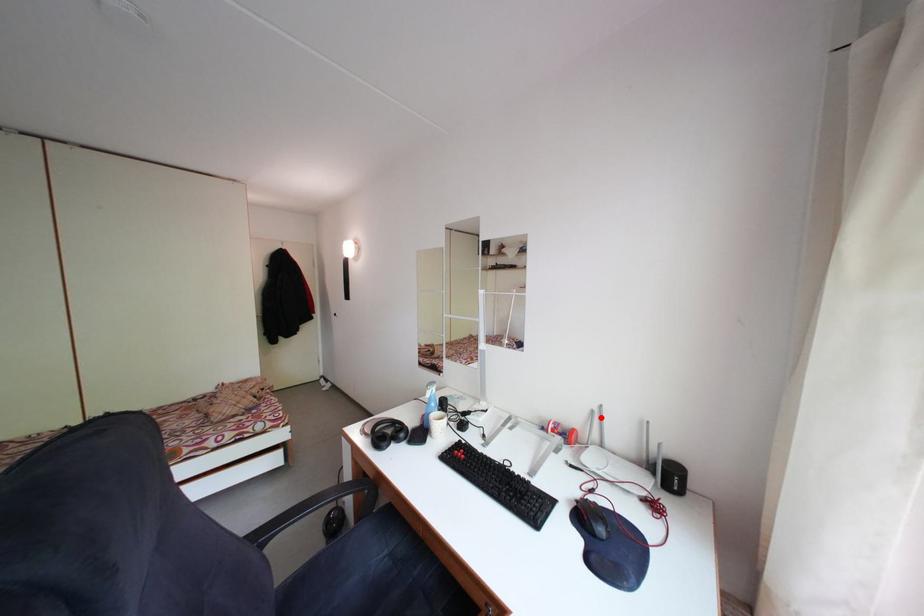
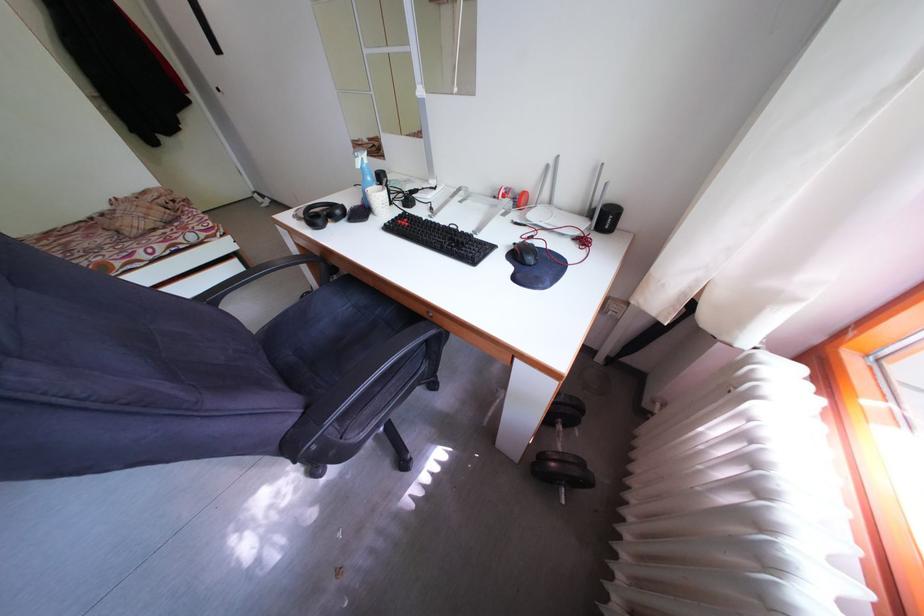
Find the pixel in the second image that matches the highlighted location in the first image.

(555, 172)